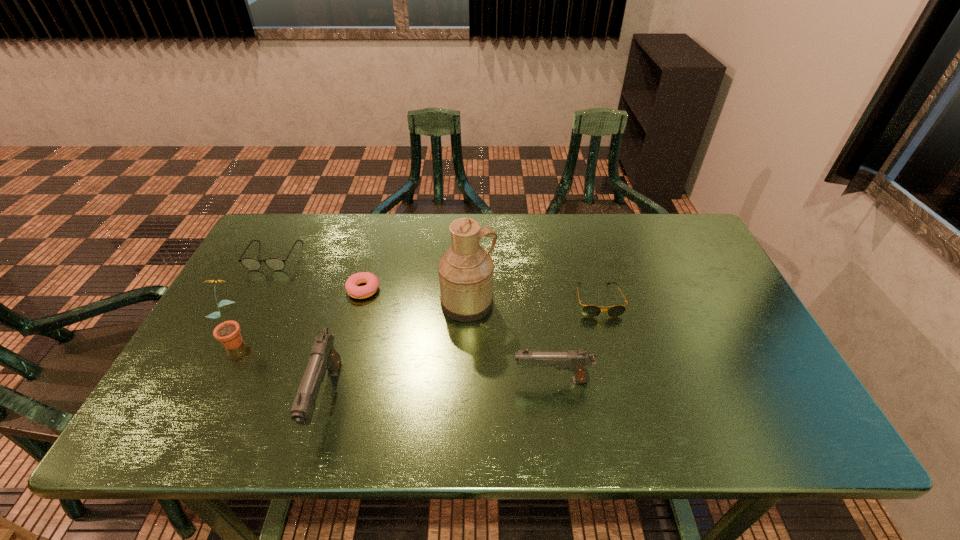
Image resolution: width=960 pixels, height=540 pixels. I want to click on object that is the fifth closest to the left gun, so click(577, 361).

The image size is (960, 540). I want to click on free space that satisfies the following two spatial constraints: 1. on the front-facing side of the spectacles; 2. on the right side of the tallest object, so click(250, 303).